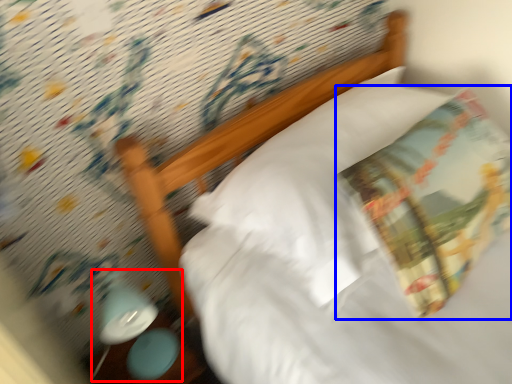
Question: Which of the following is the farthest to the observer, lamp (highlighted by a red box) or throw pillow (highlighted by a blue box)?

Choices:
 (A) lamp
 (B) throw pillow

Answer: (A)